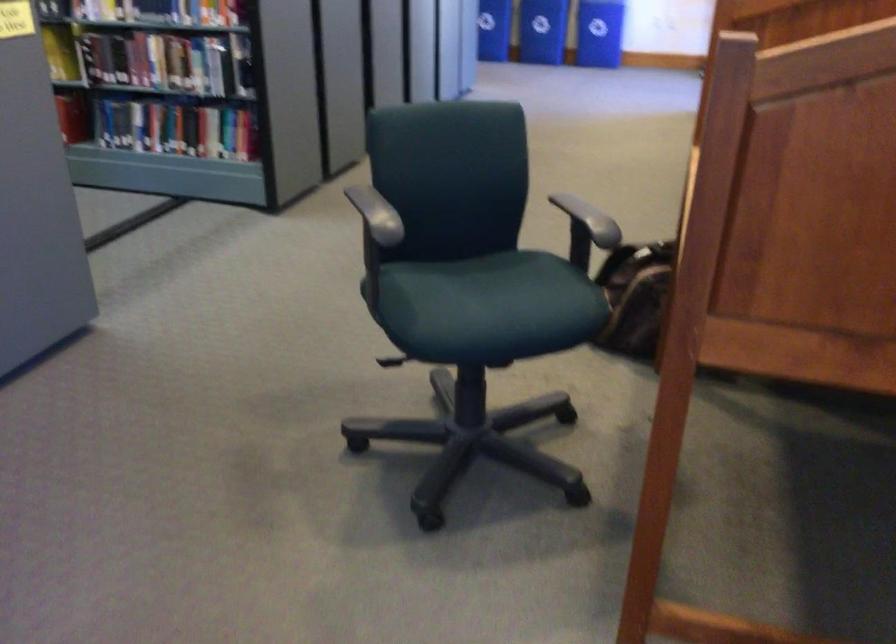
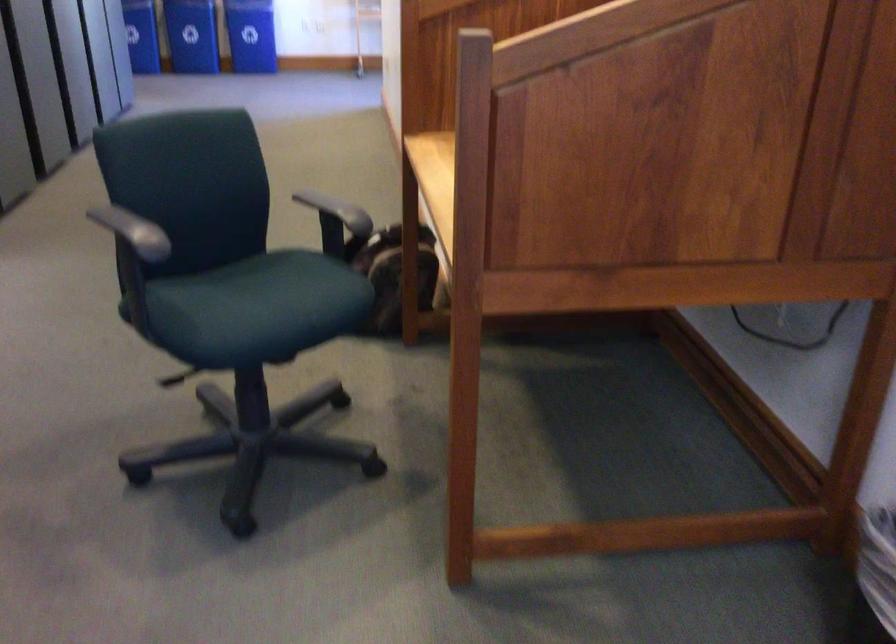
In the second image, find the point that corresponds to the point at 371,209 in the first image.

(134, 227)